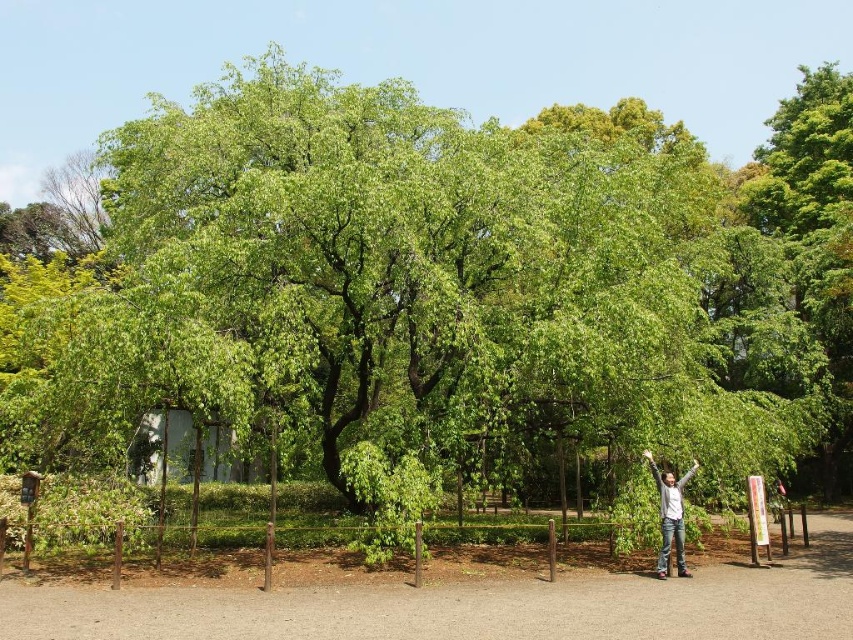
Looking at this image, can you confirm if white wood hut at lower left is positioned below gray cotton shirt at center?

Yes, white wood hut at lower left is below gray cotton shirt at center.

Does white wood hut at lower left have a greater height compared to gray cotton shirt at center?

Indeed, white wood hut at lower left has a greater height compared to gray cotton shirt at center.

Is point (163, 436) closer to camera compared to point (669, 500)?

No, it is behind (669, 500).

At what (x,y) coordinates should I click in order to perform the action: click on white wood hut at lower left. Please return your answer as a coordinate pair (x, y). The image size is (853, 640). Looking at the image, I should click on (181, 449).

Who is more forward, (x=608, y=605) or (x=218, y=465)?

Point (x=608, y=605) is more forward.

Is brown soil at lower center positioned in front of white wood hut at lower left?

Yes, brown soil at lower center is closer to the viewer.

The image size is (853, 640). Find the location of `brown soil at lower center`. brown soil at lower center is located at coordinates (469, 605).

Can you confirm if brown soil at lower center is smaller than gray cotton shirt at center?

No, brown soil at lower center is not smaller than gray cotton shirt at center.

Can you confirm if brown soil at lower center is thinner than gray cotton shirt at center?

Incorrect, brown soil at lower center's width is not less than gray cotton shirt at center's.

Is point (297, 612) closer to camera compared to point (676, 518)?

That is True.

This screenshot has height=640, width=853. What are the coordinates of `brown soil at lower center` in the screenshot? It's located at click(x=469, y=605).